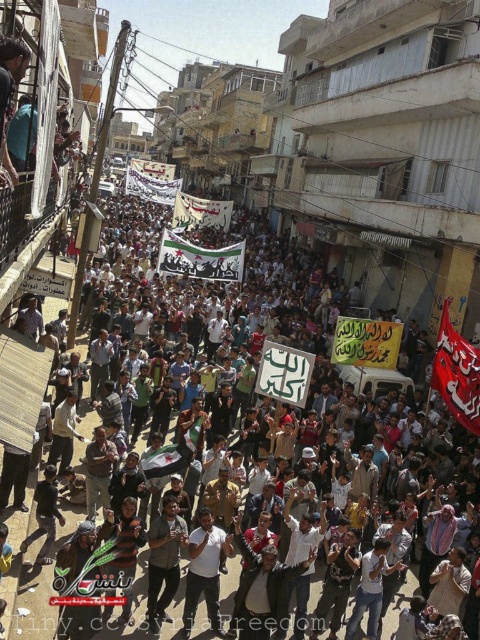
Question: Where is white cotton shirt at center located in relation to gray cotton shirt at center in the image?

Choices:
 (A) above
 (B) below

Answer: (B)

Question: From the image, what is the correct spatial relationship of white cotton shirt at center in relation to gray cotton shirt at center?

Choices:
 (A) left
 (B) right

Answer: (B)

Question: Which of the following is the farthest from the observer?

Choices:
 (A) 112,278
 (B) 233,632

Answer: (A)

Question: Which object appears farthest from the camera in this image?

Choices:
 (A) white paper signs at center
 (B) white shirt at center
 (C) white cotton shirt at center
 (D) gray cotton shirt at center

Answer: (B)

Question: Does white paper signs at center appear over white cotton shirt at center?

Choices:
 (A) yes
 (B) no

Answer: (A)

Question: Which object appears closest to the camera in this image?

Choices:
 (A) white paper signs at center
 (B) white cotton shirt at center
 (C) gray cotton shirt at center
 (D) white shirt at center

Answer: (A)